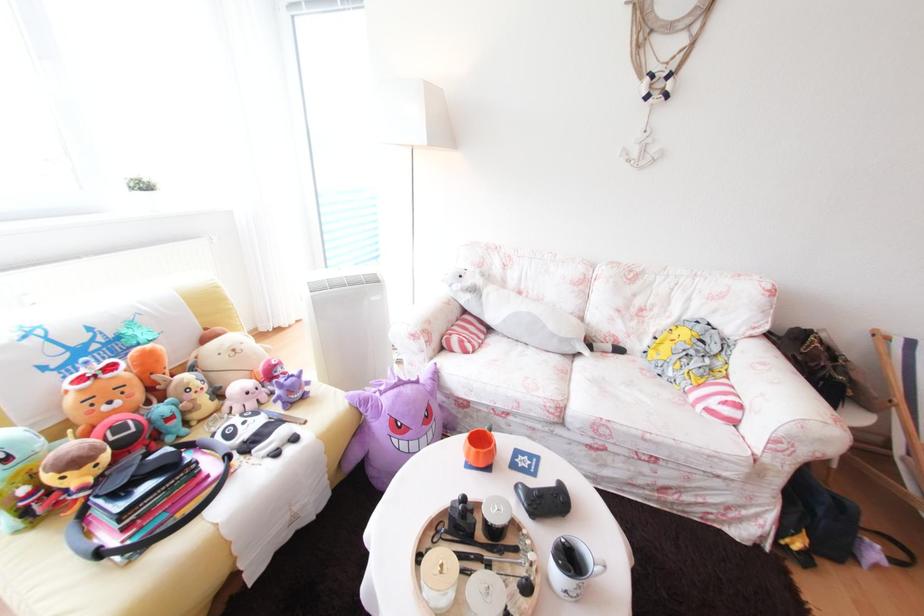
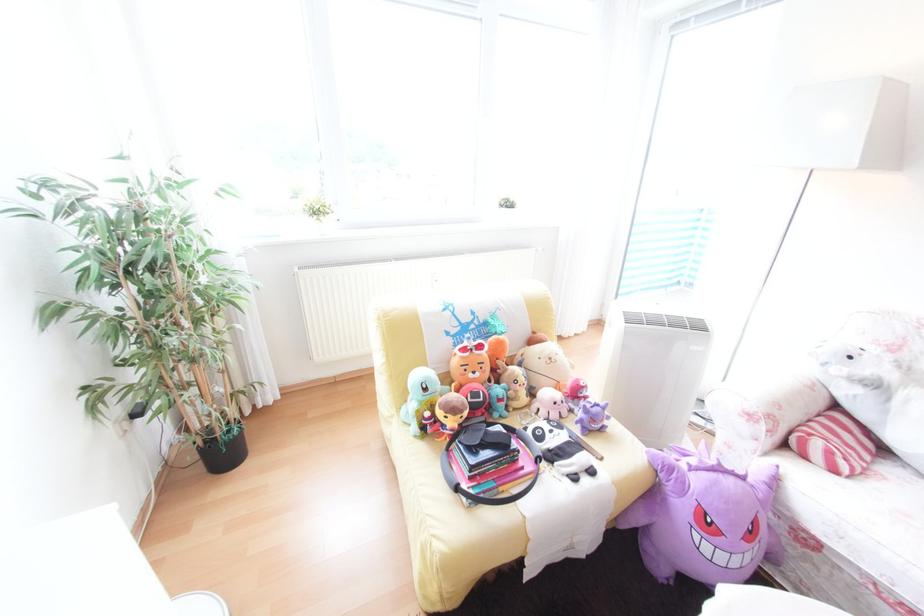
Locate, in the second image, the point that corresponds to point 205,467 in the first image.

(526, 455)